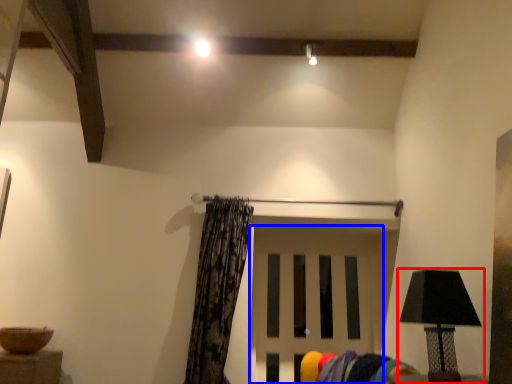
Question: Among these objects, which one is farthest to the camera, lamp (highlighted by a red box) or door (highlighted by a blue box)?

Choices:
 (A) lamp
 (B) door

Answer: (B)